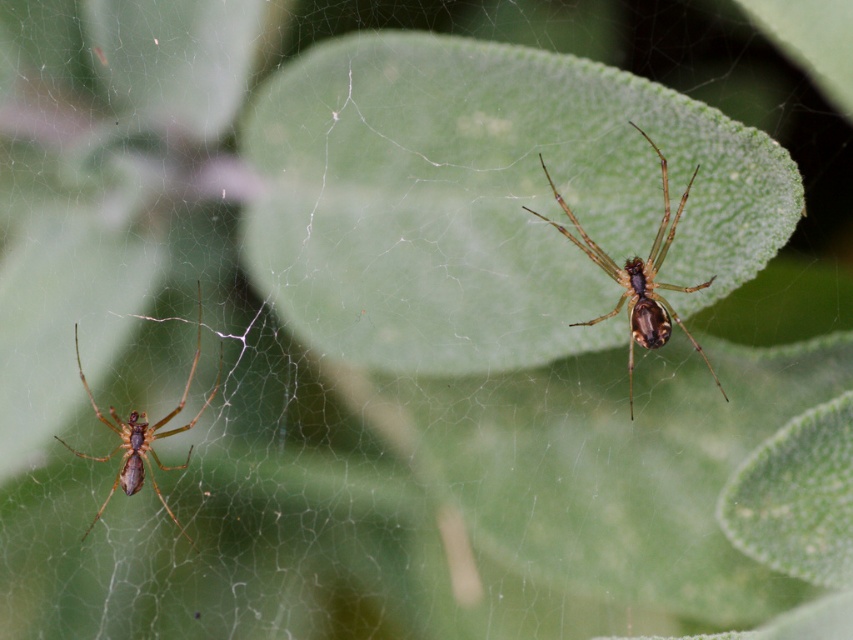
Question: Which of the following is the closest to the observer?

Choices:
 (A) brown fuzzy spider at left
 (B) brown fuzzy spider at upper right

Answer: (B)

Question: Does brown fuzzy spider at upper right appear on the right side of brown fuzzy spider at left?

Choices:
 (A) yes
 (B) no

Answer: (A)

Question: Which point is closer to the camera taking this photo?

Choices:
 (A) (641, 278)
 (B) (120, 467)

Answer: (A)

Question: Is brown fuzzy spider at upper right to the left of brown fuzzy spider at left from the viewer's perspective?

Choices:
 (A) no
 (B) yes

Answer: (A)

Question: Is brown fuzzy spider at upper right wider than brown fuzzy spider at left?

Choices:
 (A) yes
 (B) no

Answer: (A)